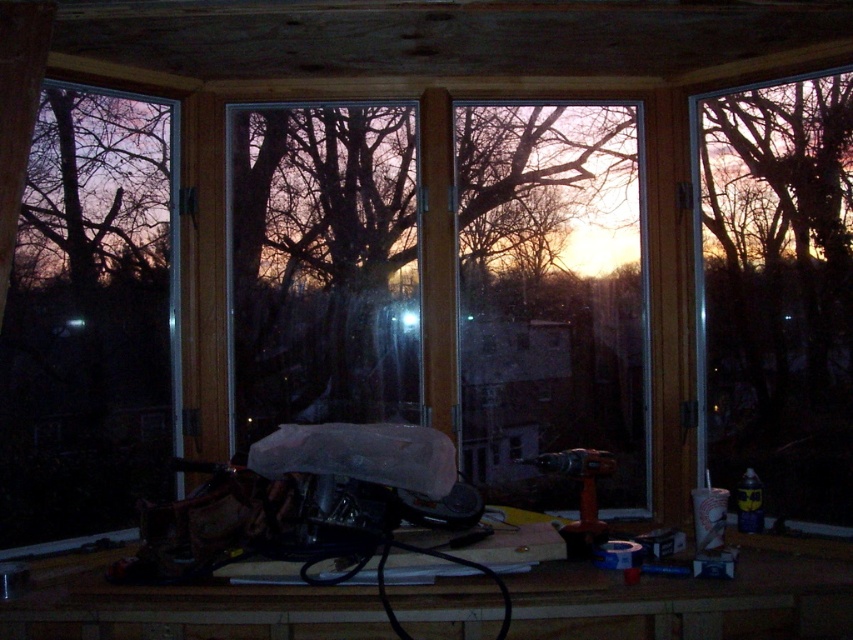
You are an interior designer assessing the lighting in this room. You notice two windows, the transparent plastic window at left and the transparent glass window at right. Based on their heights, which window might allow more natural light into the room?

The transparent plastic window at left has a greater height compared to the transparent glass window at right, so it might allow more natural light into the room since taller windows generally let in more light.

You are an interior designer inspecting the lighting in this room. You notice two transparent glass windows, the transparent glass window at center and the transparent glass window at right. Which window is located higher up in the room?

The transparent glass window at center is positioned over the transparent glass window at right, meaning it is higher up in the room.